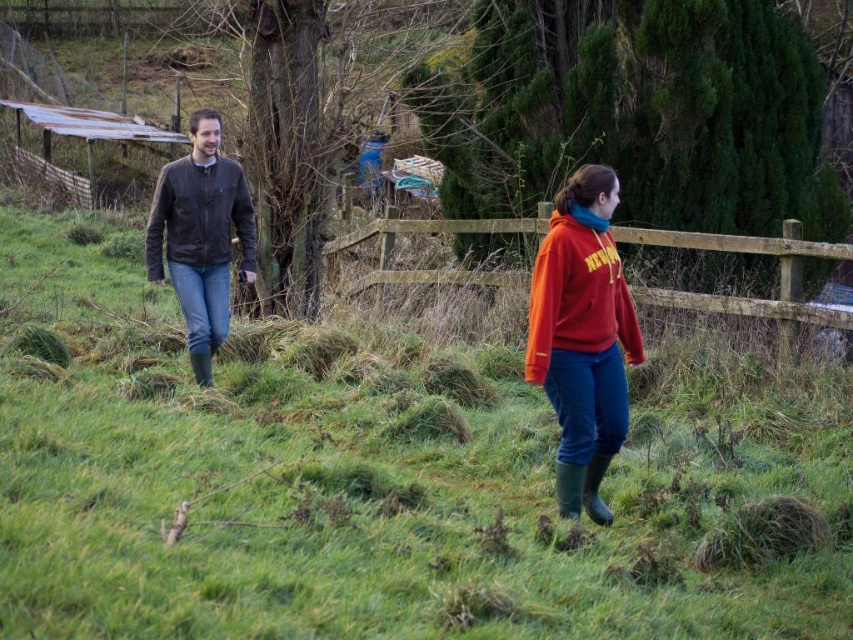
Question: Is wooden fence at center bigger than brown leather jacket at left?

Choices:
 (A) yes
 (B) no

Answer: (B)

Question: Can you confirm if matte red sweatshirt at center is thinner than brown leather jacket at left?

Choices:
 (A) no
 (B) yes

Answer: (B)

Question: Is green grassy at center further to the viewer compared to matte red hoodie at center?

Choices:
 (A) no
 (B) yes

Answer: (A)

Question: Among these objects, which one is nearest to the camera?

Choices:
 (A) leather jacket at left
 (B) green grassy at center
 (C) wooden fence at center

Answer: (B)

Question: Based on their relative distances, which object is farther from the leather jacket at left?

Choices:
 (A) wooden fence at center
 (B) brown leather jacket at left
 (C) green grassy at center
 (D) matte red sweatshirt at center

Answer: (A)

Question: Which point is farther to the camera?

Choices:
 (A) (625, 312)
 (B) (384, 256)

Answer: (B)